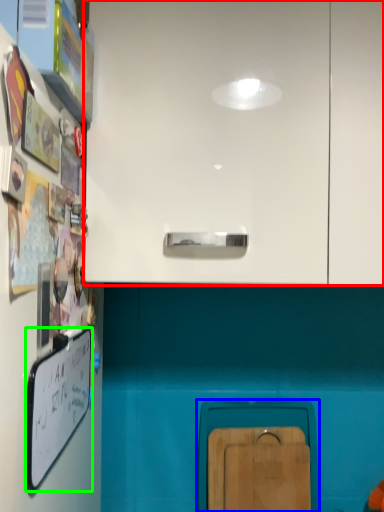
Question: Estimate the real-world distances between objects in this image. Which object is farther from cabinetry (highlighted by a red box), cabinetry (highlighted by a blue box) or whiteboard (highlighted by a green box)?

Choices:
 (A) cabinetry
 (B) whiteboard

Answer: (A)